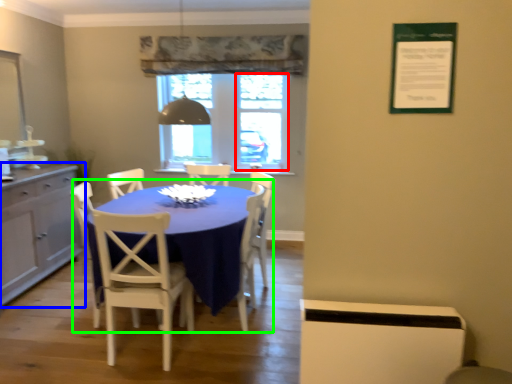
Question: Which is farther away from window screen (highlighted by a red box)? cabinetry (highlighted by a blue box) or kitchen & dining room table (highlighted by a green box)?

Choices:
 (A) cabinetry
 (B) kitchen & dining room table

Answer: (A)